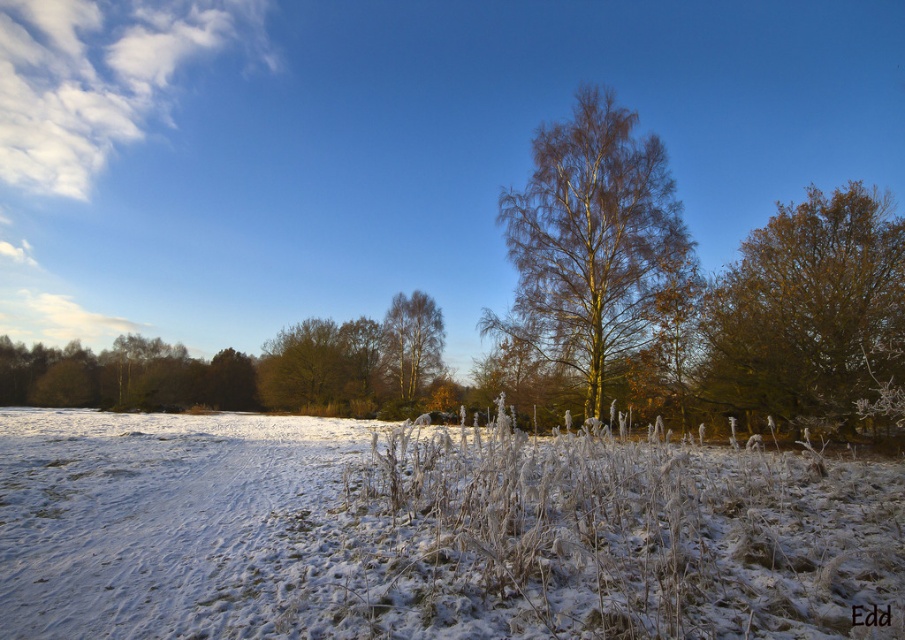
Consider the image. You are standing in the winter landscape and want to take a photo of the brown textured tree at right. Where should you position yourself to capture the tree in the frame?

To capture the brown textured tree at right in the frame, position yourself so the tree is centered at coordinates approximately 0.486 on the horizontal axis and 0.895 on the vertical axis, as this corresponds to its 2D location in the image.